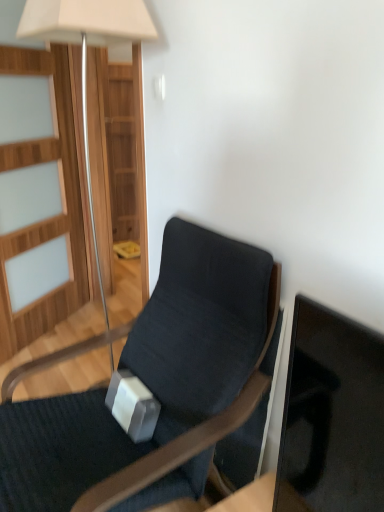
Question: Considering the positions of matte white lamp at upper left and dark fabric chair at center in the image, is matte white lamp at upper left wider or thinner than dark fabric chair at center?

Choices:
 (A) thin
 (B) wide

Answer: (A)

Question: In the image, is matte white lamp at upper left on the left side or the right side of dark fabric chair at center?

Choices:
 (A) left
 (B) right

Answer: (A)

Question: Relative to dark fabric chair at center, is matte white lamp at upper left in front or behind?

Choices:
 (A) front
 (B) behind

Answer: (B)

Question: From their relative heights in the image, would you say dark fabric chair at center is taller or shorter than matte white lamp at upper left?

Choices:
 (A) short
 (B) tall

Answer: (A)

Question: In terms of size, does dark fabric chair at center appear bigger or smaller than matte white lamp at upper left?

Choices:
 (A) small
 (B) big

Answer: (B)

Question: From a real-world perspective, relative to matte white lamp at upper left, is dark fabric chair at center vertically above or below?

Choices:
 (A) above
 (B) below

Answer: (B)

Question: Is dark fabric chair at center inside or outside of matte white lamp at upper left?

Choices:
 (A) inside
 (B) outside

Answer: (B)